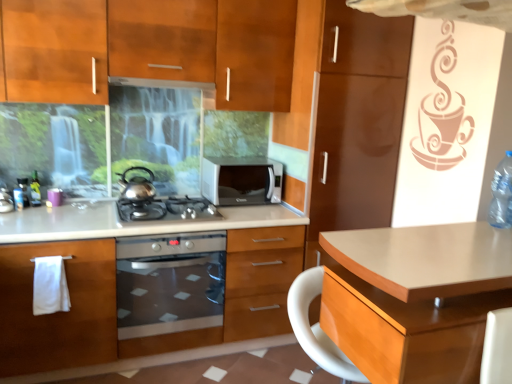
Find the location of a particular element. Image resolution: width=512 pixels, height=384 pixels. free space in front of metallic silver bottle at left, positioned as the 1th bottle in left-to-right order is located at coordinates (29, 213).